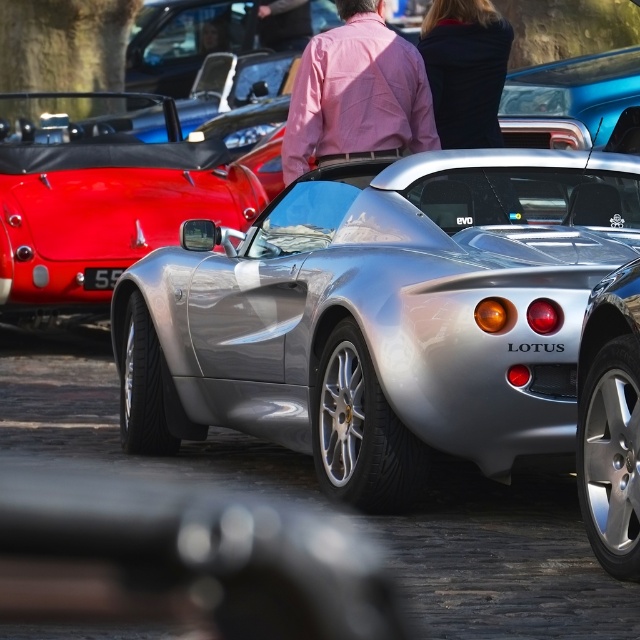
Does metallic silver sports car at center come behind pink cotton shirt at center?

Yes, it is behind pink cotton shirt at center.

This screenshot has height=640, width=640. I want to click on metallic silver sports car at center, so click(112, 211).

At what (x,y) coordinates should I click in order to perform the action: click on metallic silver sports car at center. Please return your answer as a coordinate pair (x, y). Looking at the image, I should click on (112, 211).

Can you confirm if black matte jacket at upper center is positioned below shiny blue car at upper right?

Indeed, black matte jacket at upper center is positioned under shiny blue car at upper right.

Is black matte jacket at upper center smaller than shiny blue car at upper right?

Yes.

Is point (506, 38) closer to camera compared to point (593, 144)?

Yes, point (506, 38) is closer to viewer.

Locate an element on the screen. The height and width of the screenshot is (640, 640). black matte jacket at upper center is located at coordinates (465, 68).

Between metallic silver sports car at center and black matte jacket at upper center, which one has less height?

black matte jacket at upper center is shorter.

Can you confirm if metallic silver sports car at center is positioned to the right of black matte jacket at upper center?

Incorrect, metallic silver sports car at center is not on the right side of black matte jacket at upper center.

The height and width of the screenshot is (640, 640). Describe the element at coordinates (112, 211) in the screenshot. I see `metallic silver sports car at center` at that location.

The width and height of the screenshot is (640, 640). Identify the location of metallic silver sports car at center. (112, 211).